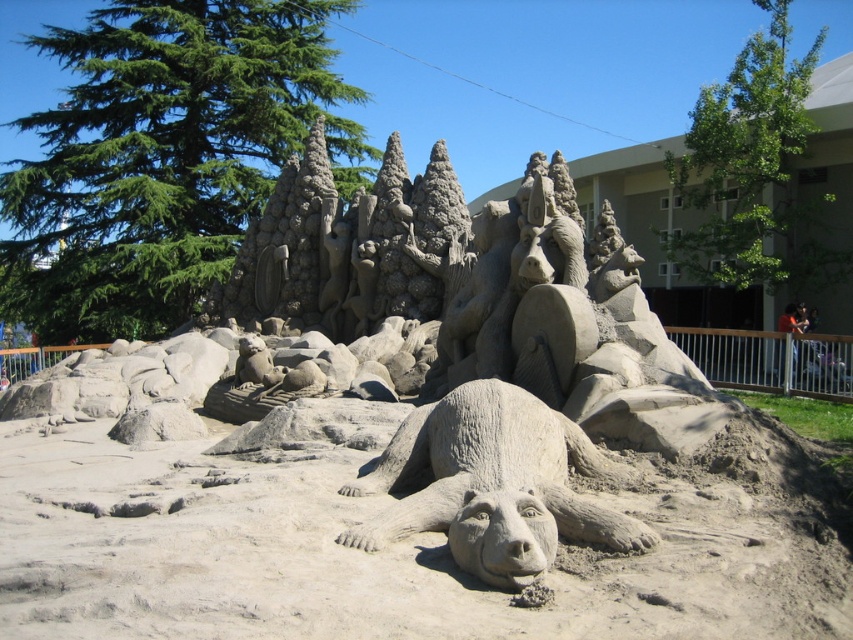
You are standing in front of the sand sculpture and want to determine which of the two points, point (x=192, y=205) or point (x=515, y=429), is closer to you. Based on the sculpture layout, which point is nearer?

Point (x=192, y=205) is closer to you because it is further to the viewer than point (x=515, y=429).

You are an artist standing in front of the sand sculpture. You want to paint the gray textured bear at center and the green coniferous tree at upper left. Which object should you paint first if you want to start with the one closer to the left side of your canvas?

The green coniferous tree at upper left should be painted first because it is positioned to the left of the gray textured bear at center, making it closer to the left side of the canvas.